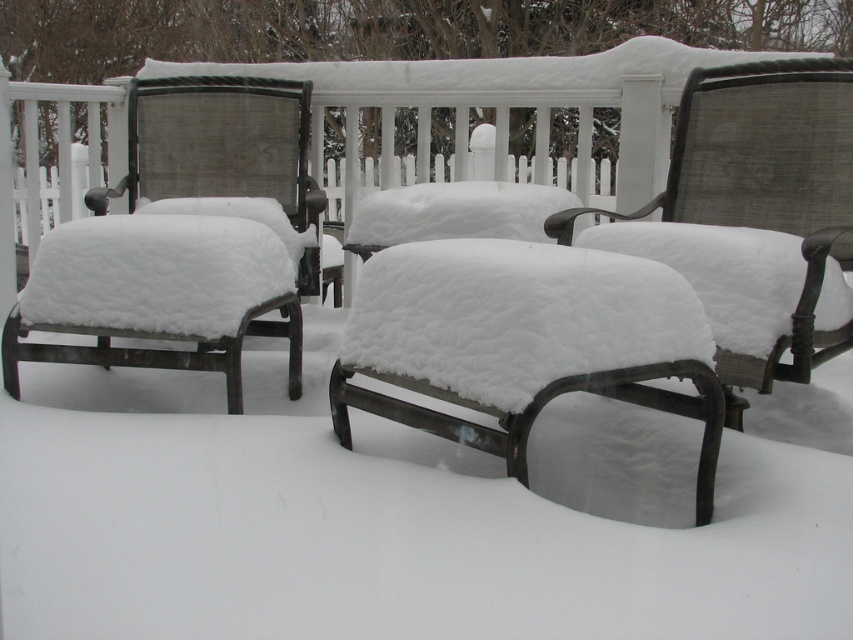
The height and width of the screenshot is (640, 853). Identify the location of snow-covered metal bench at center. (521, 340).

Does snow-covered metal bench at center have a larger size compared to metallic mesh chair at center?

Incorrect, snow-covered metal bench at center is not larger than metallic mesh chair at center.

Which is in front, point (688, 298) or point (576, 212)?

Point (688, 298) is in front.

Find the location of a particular element. snow-covered metal bench at center is located at coordinates (521, 340).

Can you confirm if matte black chair at left is wider than snow-covered metal bench at center?

Indeed, matte black chair at left has a greater width compared to snow-covered metal bench at center.

Between point (294, 92) and point (567, 353), which one is positioned in front?

Positioned in front is point (567, 353).

Where is `matte black chair at left`? This screenshot has width=853, height=640. matte black chair at left is located at coordinates (184, 237).

Where is `matte black chair at left`? matte black chair at left is located at coordinates (184, 237).

Does matte black chair at left appear on the right side of metallic mesh chair at center?

No, matte black chair at left is not to the right of metallic mesh chair at center.

Which is behind, point (202, 292) or point (804, 198)?

The point (804, 198) is more distant.

At what (x,y) coordinates should I click in order to perform the action: click on matte black chair at left. Please return your answer as a coordinate pair (x, y). This screenshot has height=640, width=853. Looking at the image, I should click on (184, 237).